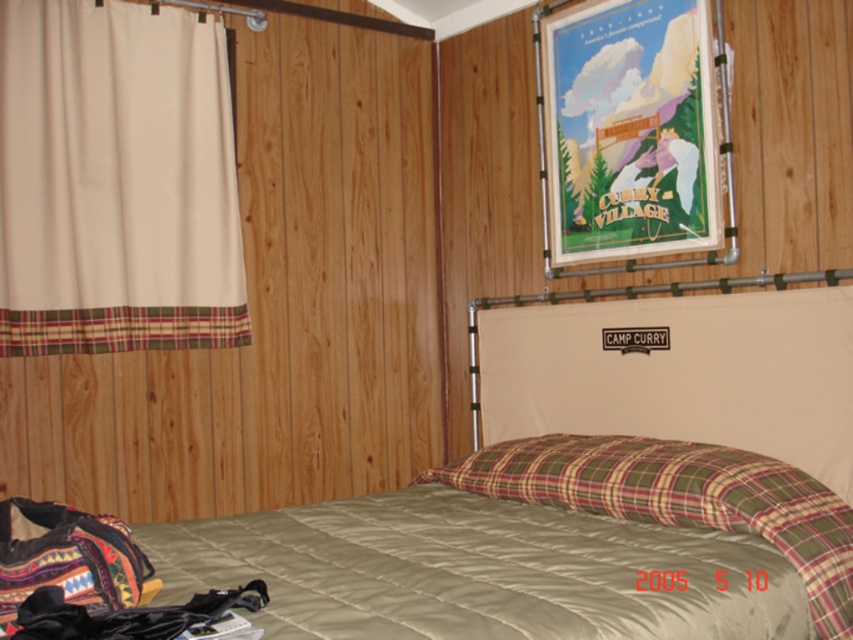
Question: From the image, what is the correct spatial relationship of beige fabric curtain at left in relation to matte paper poster at upper center?

Choices:
 (A) left
 (B) right

Answer: (A)

Question: Which of the following is the closest to the observer?

Choices:
 (A) matte paper poster at upper center
 (B) beige fabric curtain at left
 (C) green quilted bed at center
 (D) plaid fabric pillow at center

Answer: (C)

Question: Which of the following is the farthest from the observer?

Choices:
 (A) (840, 476)
 (B) (514, 445)
 (C) (132, 145)
 (D) (712, 198)

Answer: (C)

Question: Is beige fabric curtain at left to the left of matte paper poster at upper center from the viewer's perspective?

Choices:
 (A) no
 (B) yes

Answer: (B)

Question: Is beige fabric curtain at left closer to camera compared to matte paper poster at upper center?

Choices:
 (A) no
 (B) yes

Answer: (A)

Question: Which is nearer to the plaid fabric pillow at center?

Choices:
 (A) green quilted bed at center
 (B) beige fabric curtain at left

Answer: (A)